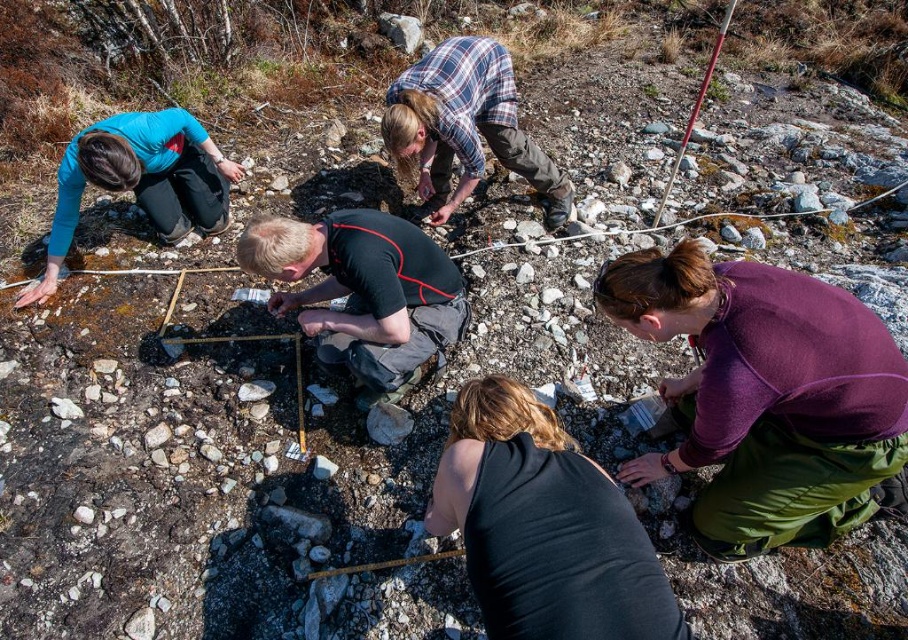
Question: Does purple fleece jacket at lower right have a larger size compared to matte blue shirt at upper left?

Choices:
 (A) no
 (B) yes

Answer: (A)

Question: Which is farther from the matte blue shirt at upper left?

Choices:
 (A) plaid flannel shirt at upper center
 (B) black matte shirt at center
 (C) black matte tank top at lower center

Answer: (C)

Question: Can you confirm if plaid flannel shirt at upper center is bigger than matte blue shirt at upper left?

Choices:
 (A) yes
 (B) no

Answer: (A)

Question: Which of the following is the closest to the observer?

Choices:
 (A) black matte shirt at center
 (B) plaid flannel shirt at upper center

Answer: (A)

Question: Estimate the real-world distances between objects in this image. Which object is farther from the plaid flannel shirt at upper center?

Choices:
 (A) black matte tank top at lower center
 (B) purple fleece jacket at lower right
 (C) black matte shirt at center

Answer: (A)

Question: Does purple fleece jacket at lower right have a lesser width compared to plaid flannel shirt at upper center?

Choices:
 (A) no
 (B) yes

Answer: (A)